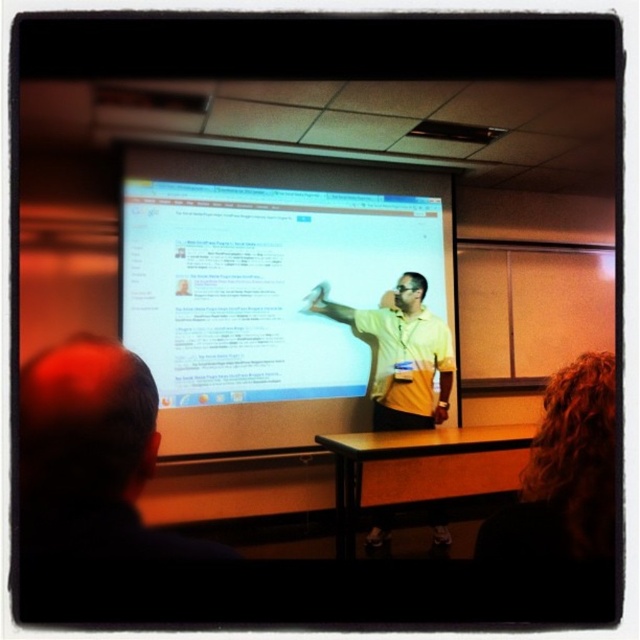
Question: Can you confirm if white glossy projection screen at center is positioned above curly hair at upper right?

Choices:
 (A) no
 (B) yes

Answer: (B)

Question: Does white glossy projection screen at center have a larger size compared to curly hair at upper right?

Choices:
 (A) yes
 (B) no

Answer: (A)

Question: Which point is closer to the camera?

Choices:
 (A) (406, 369)
 (B) (554, 412)
 (C) (330, 349)

Answer: (B)

Question: Does white glossy projection screen at center appear on the left side of curly hair at upper right?

Choices:
 (A) no
 (B) yes

Answer: (B)

Question: Based on their relative distances, which object is nearer to the white glossy projection screen at center?

Choices:
 (A) yellow matte shirt at center
 (B) curly hair at upper right

Answer: (A)

Question: Which point is farther from the camera taking this photo?

Choices:
 (A) (444, 417)
 (B) (209, 417)

Answer: (A)